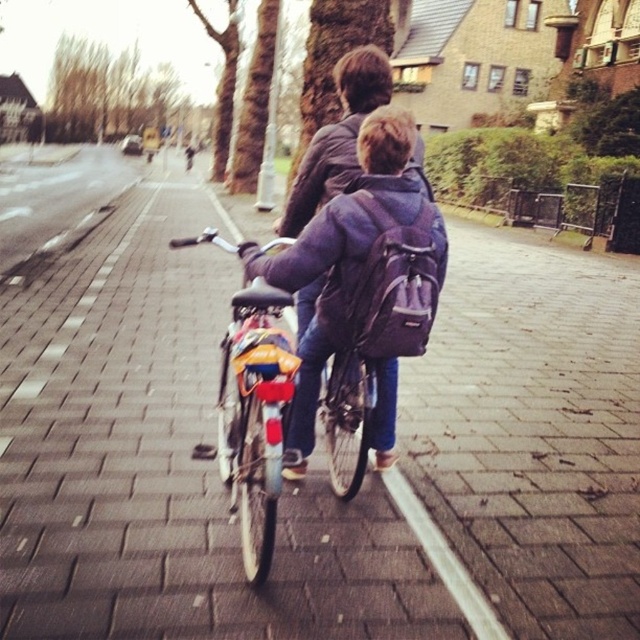
You are a pedestrian standing on the side of the pathway. You see the metallic silver bicycle at center and the purple fabric backpack at center. Which object is closer to you?

The metallic silver bicycle at center is closer to you because it is positioned in front of the purple fabric backpack at center.

What is located at the coordinates point (253, 417) in the image?

The metallic silver bicycle at center is located at point (253, 417).

You are a delivery drone flying overhead and need to drop a package at the exact location of the metallic silver bicycle at center. What are the coordinates where you should drop the package?

The metallic silver bicycle at center is located at coordinates point (253, 417), so you should drop the package there.